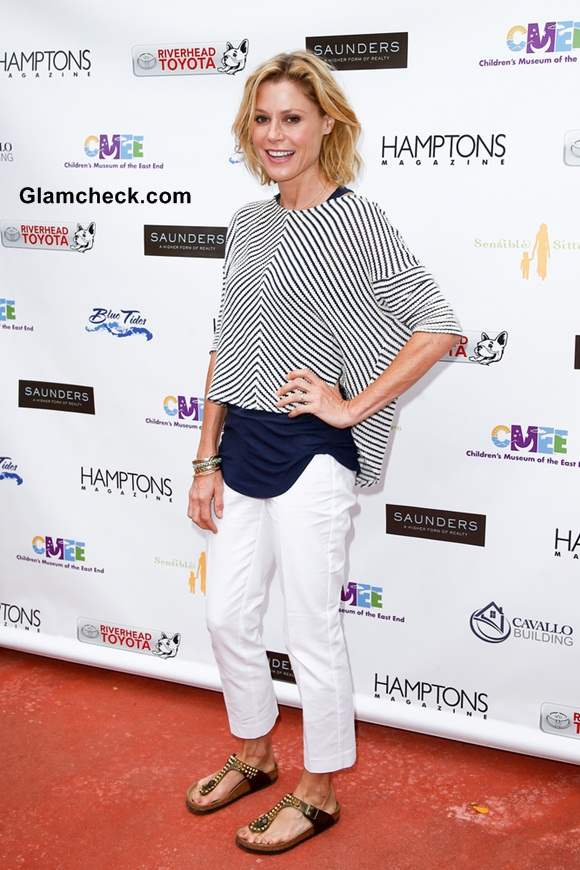
You are a GUI agent. You are given a task and a screenshot of the screen. Output one action in this format:
    pyautogui.click(x=<x>, y=<y>)
    Task: Click on the floor
    The height and width of the screenshot is (870, 580).
    Given the screenshot: What is the action you would take?
    pyautogui.click(x=514, y=791)